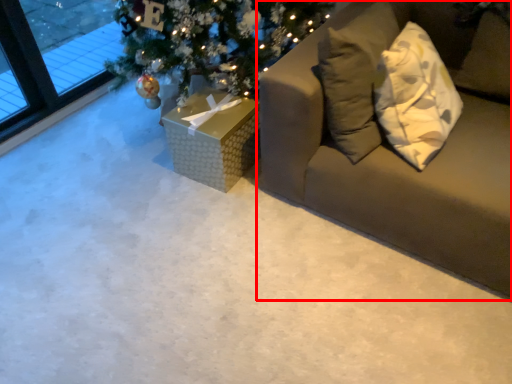
Question: Considering the relative positions of studio couch (annotated by the red box) and furniture in the image provided, where is studio couch (annotated by the red box) located with respect to the staircase?

Choices:
 (A) right
 (B) left

Answer: (A)